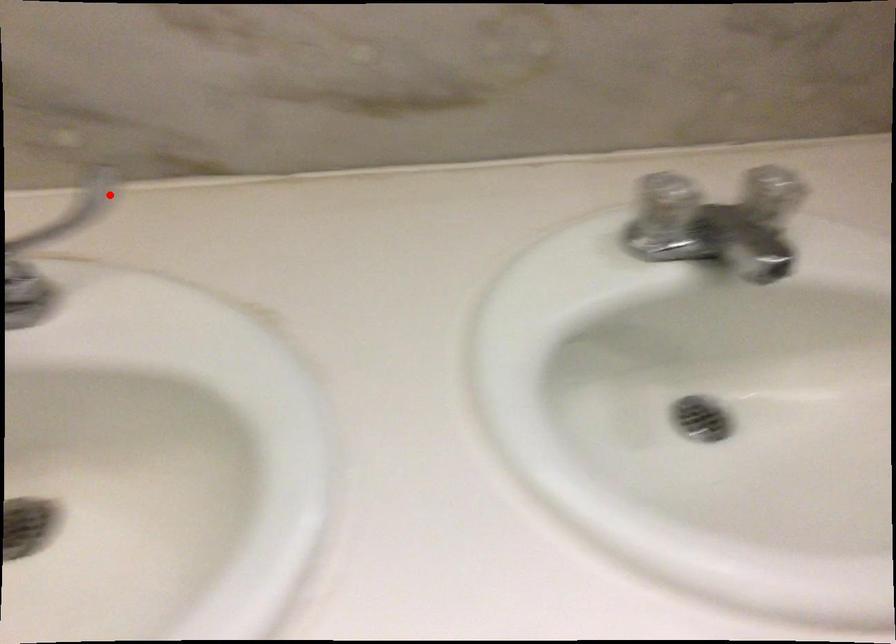
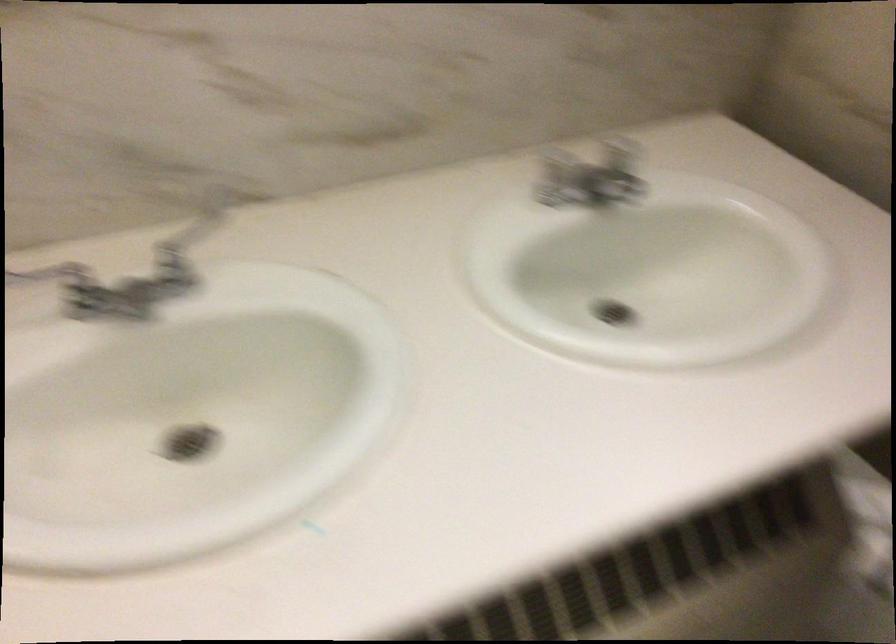
Question: I am providing you with two images of the same scene from different viewpoints. In image1, a red point is highlighted. Considering the same 3D point in image2, which of the following is correct?

Choices:
 (A) It is closer
 (B) It is farther

Answer: (B)